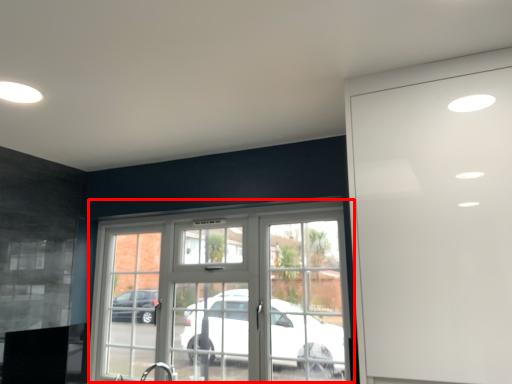
Question: Considering the relative positions of window (annotated by the red box) and garage door in the image provided, where is window (annotated by the red box) located with respect to the staircase?

Choices:
 (A) right
 (B) left

Answer: (B)